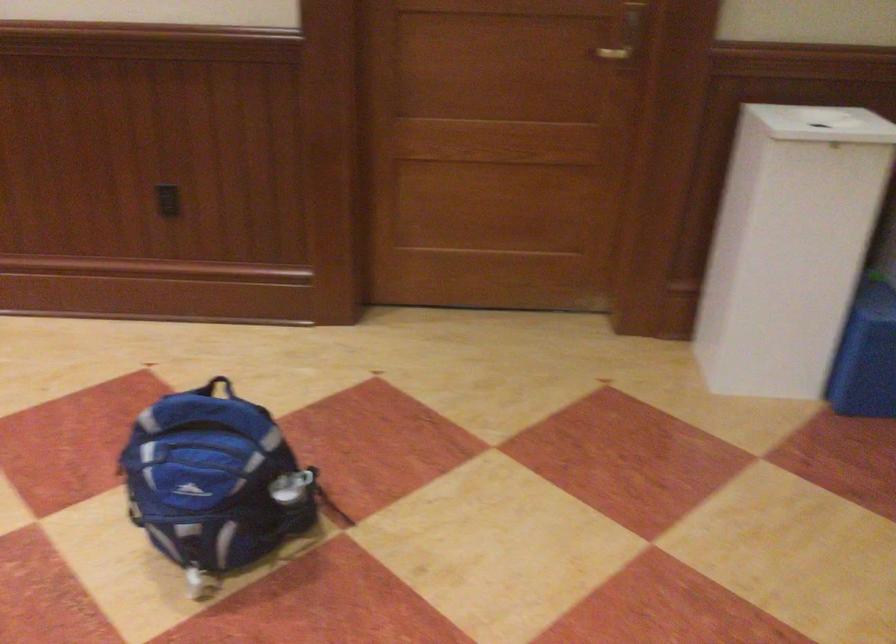
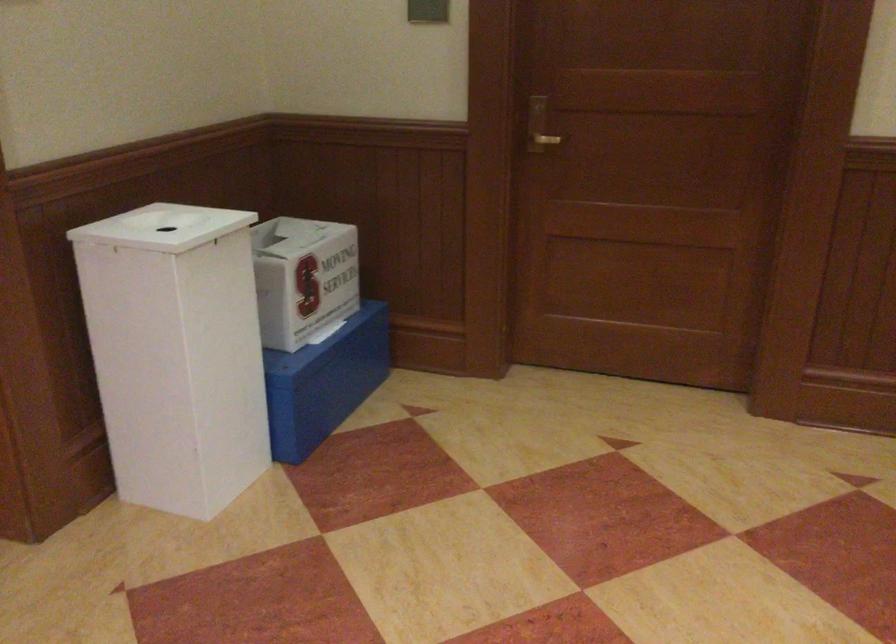
Where in the second image is the point corresponding to pixel 741 230 from the first image?

(176, 353)